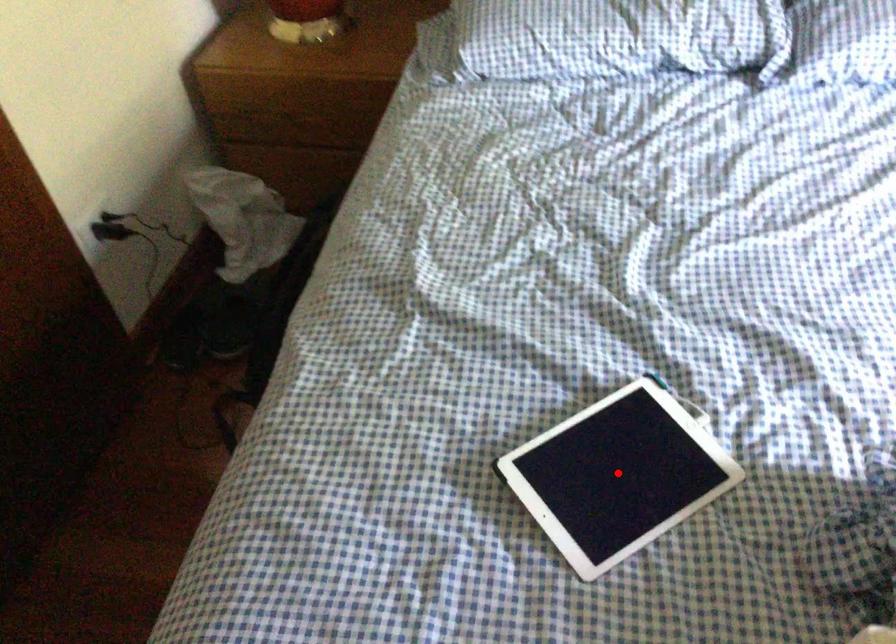
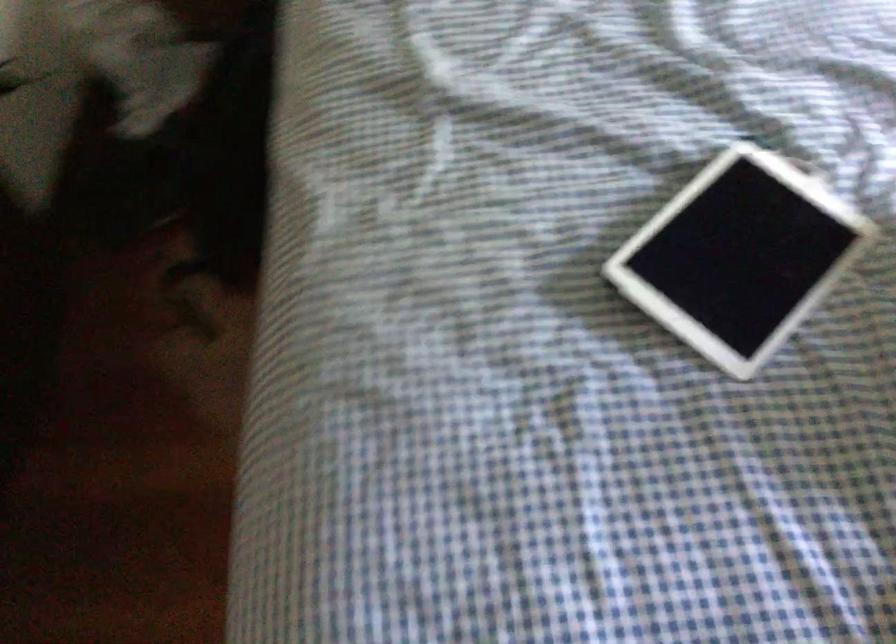
Question: I am providing you with two images of the same scene from different viewpoints. Image1 has a red point marked. In image2, the corresponding 3D location appears at what relative position? Reply with the corresponding letter.

Choices:
 (A) Closer
 (B) Farther

Answer: (A)